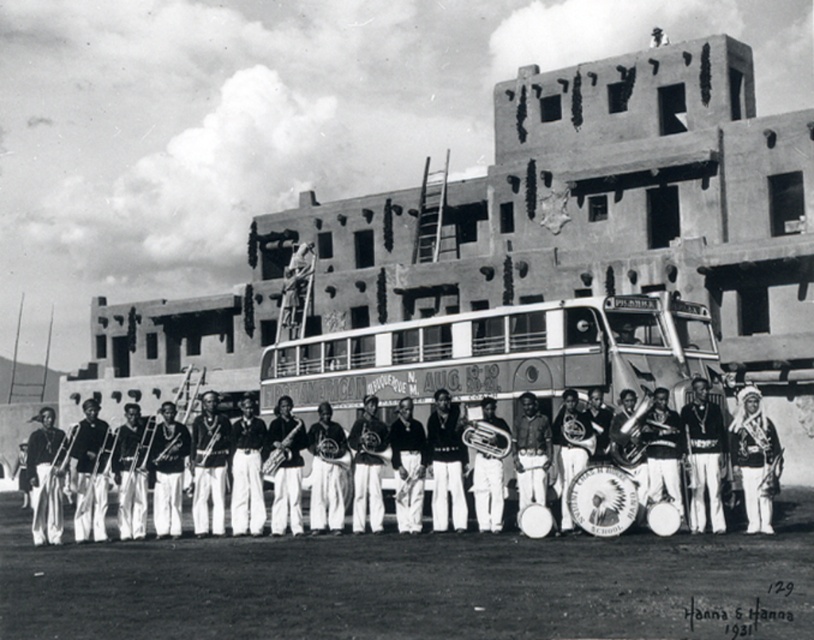
Which is more to the right, dark brown leather jacket at center or smooth wood drum at center?

From the viewer's perspective, smooth wood drum at center appears more on the right side.

Identify the location of dark brown leather jacket at center. This screenshot has width=814, height=640. (90, 474).

Which of these two, white fabric headdress at center or dark brown leather jacket at left, stands taller?

Standing taller between the two is dark brown leather jacket at left.

Is point (738, 428) positioned behind point (60, 520)?

No.

Locate an element on the screen. white fabric headdress at center is located at coordinates (755, 458).

In the scene shown: Is white fabric headdress at center thinner than smooth wood drum at center?

Yes.

Who is taller, white fabric headdress at center or smooth wood drum at center?

smooth wood drum at center is taller.

Who is more distant from viewer, (738,464) or (291,432)?

Point (291,432)

At what (x,y) coordinates should I click in order to perform the action: click on white fabric headdress at center. Please return your answer as a coordinate pair (x, y). The height and width of the screenshot is (640, 814). Looking at the image, I should click on (755, 458).